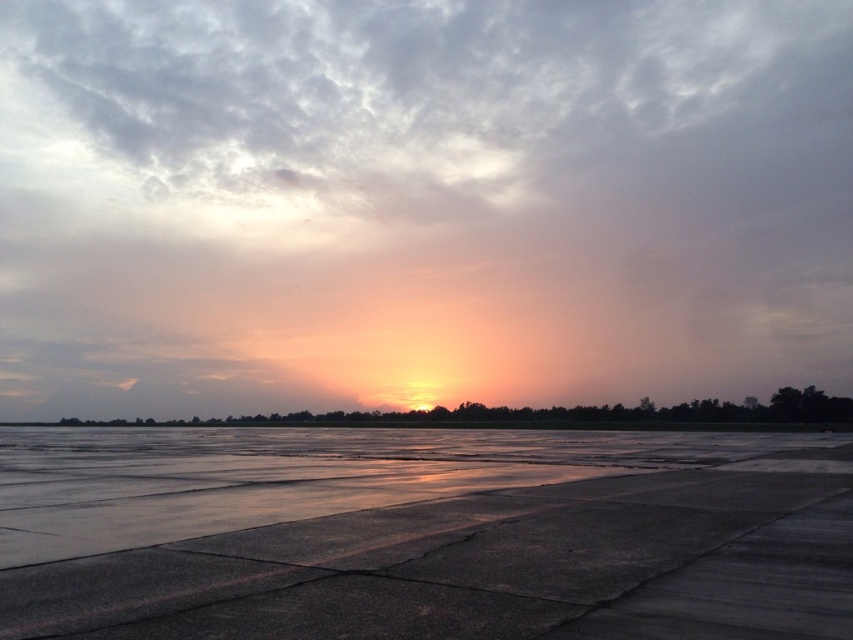
Question: Among these objects, which one is farthest from the camera?

Choices:
 (A) sunset sky at center
 (B) smooth asphalt tarmac at center
 (C) gray fluffy cloud at upper center

Answer: (C)

Question: In this image, where is smooth asphalt tarmac at center located relative to sunset sky at center?

Choices:
 (A) right
 (B) left

Answer: (A)

Question: Which object appears closest to the camera in this image?

Choices:
 (A) sunset sky at center
 (B) smooth asphalt tarmac at center

Answer: (B)

Question: Is gray fluffy cloud at upper center to the left of sunset sky at center from the viewer's perspective?

Choices:
 (A) no
 (B) yes

Answer: (A)

Question: Is gray fluffy cloud at upper center to the right of smooth asphalt tarmac at center from the viewer's perspective?

Choices:
 (A) no
 (B) yes

Answer: (B)

Question: Which point is closer to the camera taking this photo?

Choices:
 (A) (466, 419)
 (B) (775, 602)
 (C) (729, 65)

Answer: (B)